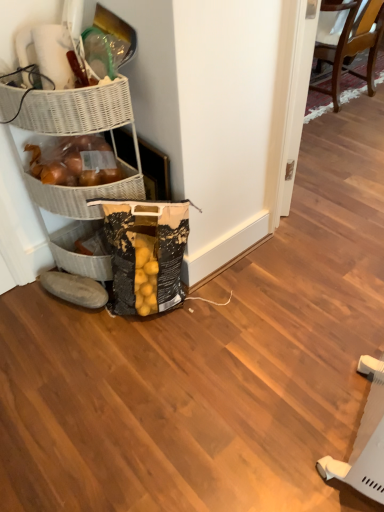
The height and width of the screenshot is (512, 384). Describe the element at coordinates (88, 190) in the screenshot. I see `white wicker basket at upper left` at that location.

Locate an element on the screen. The height and width of the screenshot is (512, 384). white wicker basket at upper left is located at coordinates (88, 190).

The height and width of the screenshot is (512, 384). Find the location of `black textured grocery bag at lower left`. black textured grocery bag at lower left is located at coordinates (146, 253).

Measure the distance between wooden chair at upper right and camera.

The depth of wooden chair at upper right is 2.40 meters.

Find the location of a particular element. This screenshot has height=512, width=384. white wicker basket at upper left is located at coordinates (x=88, y=190).

In terms of width, does black textured grocery bag at lower left look wider or thinner when compared to white wicker basket at upper left?

Considering their sizes, black textured grocery bag at lower left looks slimmer than white wicker basket at upper left.

In the scene shown: Is black textured grocery bag at lower left to the left or to the right of white wicker basket at upper left in the image?

Clearly, black textured grocery bag at lower left is on the right of white wicker basket at upper left in the image.

How different are the orientations of black textured grocery bag at lower left and white wicker basket at upper left in degrees?

The angular difference between black textured grocery bag at lower left and white wicker basket at upper left is 46.9 degrees.

From the image's perspective, is black textured grocery bag at lower left below white wicker basket at upper left?

Yes, from the image's perspective, black textured grocery bag at lower left is beneath white wicker basket at upper left.

Is point (44, 280) farther from viewer compared to point (348, 20)?

No, it is in front of (348, 20).

Does gray fabric slipper at lower left have a greater width compared to wooden chair at upper right?

In fact, gray fabric slipper at lower left might be narrower than wooden chair at upper right.

Find the location of `footwear that is on the left side of wooden chair at upper right`. footwear that is on the left side of wooden chair at upper right is located at coordinates (75, 289).

Looking at this image, relative to black textured grocery bag at lower left, is white wicker basket at upper left in front or behind?

Visually, white wicker basket at upper left is located behind black textured grocery bag at lower left.

Does white wicker basket at upper left have a greater height compared to black textured grocery bag at lower left?

In fact, white wicker basket at upper left may be shorter than black textured grocery bag at lower left.

Find the location of `grocery bag that appears below the white wicker basket at upper left (from the image's perspective)`. grocery bag that appears below the white wicker basket at upper left (from the image's perspective) is located at coordinates (146, 253).

Is white wicker basket at upper left to the left of black textured grocery bag at lower left from the viewer's perspective?

Correct, you'll find white wicker basket at upper left to the left of black textured grocery bag at lower left.

Locate an element on the screen. chair that appears below the white wicker basket at upper left (from a real-world perspective) is located at coordinates (349, 41).

Between wooden chair at upper right and white wicker basket at upper left, which one appears on the left side from the viewer's perspective?

white wicker basket at upper left is more to the left.

From a real-world perspective, which is physically below, wooden chair at upper right or white wicker basket at upper left?

From a 3D spatial view, wooden chair at upper right is below.

From the image's perspective, is wooden chair at upper right located above or below white wicker basket at upper left?

Clearly, from the image's perspective, wooden chair at upper right is above white wicker basket at upper left.

Is white wicker basket at upper left positioned far away from wooden chair at upper right?

Absolutely, white wicker basket at upper left is distant from wooden chair at upper right.

From a real-world perspective, is white wicker basket at upper left positioned under wooden chair at upper right based on gravity?

No, from a real-world perspective, white wicker basket at upper left is not beneath wooden chair at upper right.

Is point (124, 163) closer or farther from the camera than point (328, 10)?

Point (124, 163).

Is white wicker basket at upper left oriented away from wooden chair at upper right?

No, wooden chair at upper right is not at the back of white wicker basket at upper left.

Considering the relative sizes of black textured grocery bag at lower left and gray fabric slipper at lower left in the image provided, is black textured grocery bag at lower left wider than gray fabric slipper at lower left?

Yes, black textured grocery bag at lower left is wider than gray fabric slipper at lower left.

Could you tell me if black textured grocery bag at lower left is turned towards gray fabric slipper at lower left?

No, black textured grocery bag at lower left is not turned towards gray fabric slipper at lower left.

Relative to gray fabric slipper at lower left, is black textured grocery bag at lower left in front or behind?

Clearly, black textured grocery bag at lower left is in front of gray fabric slipper at lower left.

Find the location of a particular element. Image resolution: width=384 pixels, height=512 pixels. grocery bag lying on the right of gray fabric slipper at lower left is located at coordinates (146, 253).

Is black textured grocery bag at lower left directly adjacent to wooden chair at upper right?

black textured grocery bag at lower left is not next to wooden chair at upper right, and they're not touching.

Between black textured grocery bag at lower left and wooden chair at upper right, which one is positioned in front?

black textured grocery bag at lower left is more forward.

From a real-world perspective, is black textured grocery bag at lower left on top of wooden chair at upper right?

Incorrect, from a real-world perspective, black textured grocery bag at lower left is lower than wooden chair at upper right.

Considering the sizes of black textured grocery bag at lower left and wooden chair at upper right in the image, is black textured grocery bag at lower left bigger or smaller than wooden chair at upper right?

black textured grocery bag at lower left is smaller than wooden chair at upper right.

Where is `grocery bag in front of the white wicker basket at upper left`? Image resolution: width=384 pixels, height=512 pixels. grocery bag in front of the white wicker basket at upper left is located at coordinates (146, 253).

Locate an element on the screen. This screenshot has width=384, height=512. footwear that appears below the wooden chair at upper right (from the image's perspective) is located at coordinates (75, 289).

Based on their spatial positions, is wooden chair at upper right or gray fabric slipper at lower left further from black textured grocery bag at lower left?

Among the two, wooden chair at upper right is located further to black textured grocery bag at lower left.

Considering their positions, is black textured grocery bag at lower left positioned closer to gray fabric slipper at lower left than wooden chair at upper right?

black textured grocery bag at lower left.

When comparing their distances from black textured grocery bag at lower left, does gray fabric slipper at lower left or wooden chair at upper right seem further?

wooden chair at upper right is positioned further to the anchor black textured grocery bag at lower left.

When comparing their distances from gray fabric slipper at lower left, does black textured grocery bag at lower left or white wicker basket at upper left seem closer?

black textured grocery bag at lower left is positioned closer to the anchor gray fabric slipper at lower left.

Considering their positions, is gray fabric slipper at lower left positioned closer to white wicker basket at upper left than wooden chair at upper right?

gray fabric slipper at lower left is positioned closer to the anchor white wicker basket at upper left.

Which object lies further to the anchor point black textured grocery bag at lower left, gray fabric slipper at lower left or white wicker basket at upper left?

gray fabric slipper at lower left is positioned further to the anchor black textured grocery bag at lower left.

Estimate the real-world distances between objects in this image. Which object is further from white wicker basket at upper left, black textured grocery bag at lower left or gray fabric slipper at lower left?

Based on the image, gray fabric slipper at lower left appears to be further to white wicker basket at upper left.

Estimate the real-world distances between objects in this image. Which object is closer to wooden chair at upper right, white wicker basket at upper left or black textured grocery bag at lower left?

black textured grocery bag at lower left is positioned closer to the anchor wooden chair at upper right.

Where is `basket between gray fabric slipper at lower left and wooden chair at upper right`? basket between gray fabric slipper at lower left and wooden chair at upper right is located at coordinates tap(88, 190).

Identify the location of grocery bag between white wicker basket at upper left and gray fabric slipper at lower left in the up-down direction. (146, 253).

The image size is (384, 512). In order to click on basket that lies between wooden chair at upper right and black textured grocery bag at lower left from top to bottom in this screenshot , I will do `click(88, 190)`.

At what (x,y) coordinates should I click in order to perform the action: click on grocery bag between wooden chair at upper right and gray fabric slipper at lower left vertically. Please return your answer as a coordinate pair (x, y). Looking at the image, I should click on click(146, 253).